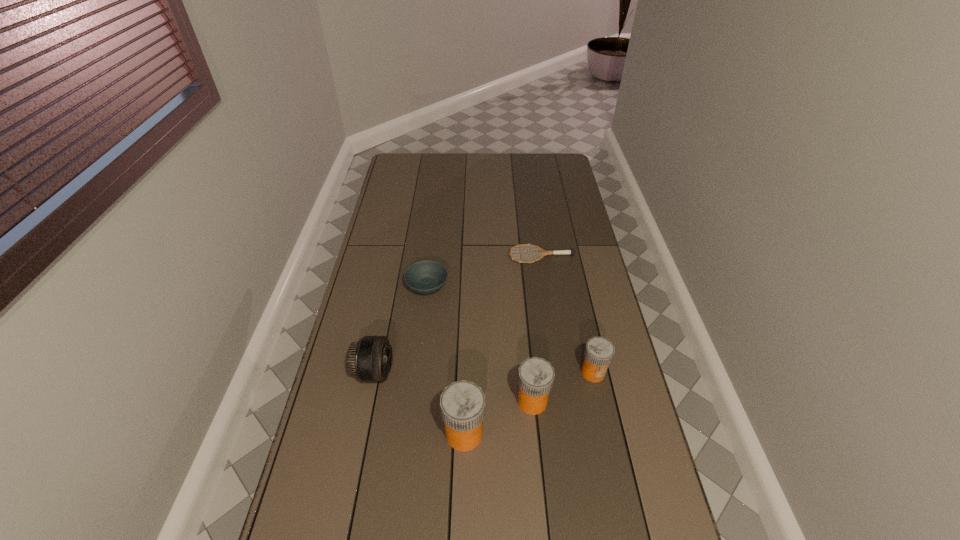
Where is `vacant area at the right edge`? This screenshot has width=960, height=540. vacant area at the right edge is located at coordinates pos(561,233).

What are the coordinates of `vacant area that lies between the second farthest object and the third object from left to right` in the screenshot? It's located at (445, 360).

Locate an element on the screen. vacant space in between the second tallest medicine and the soup bowl is located at coordinates (480, 344).

Locate an element on the screen. Image resolution: width=960 pixels, height=540 pixels. empty location between the rightmost medicine and the fifth tallest object is located at coordinates (510, 329).

At what (x,y) coordinates should I click in order to perform the action: click on vacant area that lies between the second medicine from left to right and the third object from left to right. Please return your answer as a coordinate pair (x, y). This screenshot has height=540, width=960. Looking at the image, I should click on (498, 417).

I want to click on vacant region between the tennis racket and the fifth tallest object, so click(485, 271).

Locate an element on the screen. free space between the soup bowl and the third object from left to right is located at coordinates (445, 360).

Locate an element on the screen. This screenshot has width=960, height=540. free space between the telephoto lens and the farthest object is located at coordinates (458, 314).

Image resolution: width=960 pixels, height=540 pixels. Find the location of `free spot between the soup bowl and the shortest object`. free spot between the soup bowl and the shortest object is located at coordinates (485, 271).

You are a GUI agent. You are given a task and a screenshot of the screen. Output one action in this format:
    pyautogui.click(x=<x>, y=<y>)
    Task: Click on the vacant area that lies between the shortest object and the second shortest medicine
    
    Given the screenshot: What is the action you would take?
    pyautogui.click(x=537, y=329)